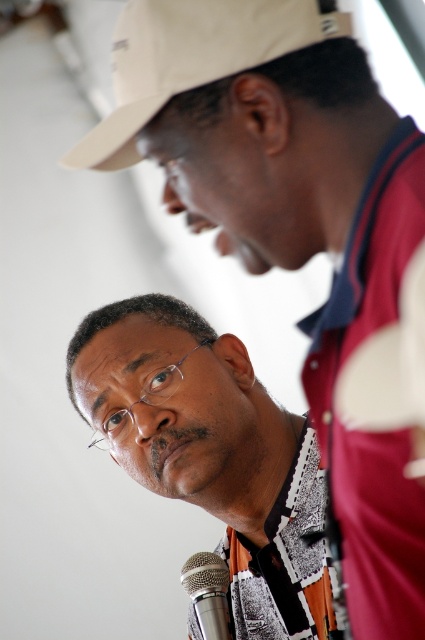
You are a photographer at an indoor event. You need to capture a photo of the white textured shirt at center and the silver metallic microphone at lower center. Which object should you focus on first if you want to ensure both are in focus?

The white textured shirt at center is above the silver metallic microphone at lower center, so you should focus on the white textured shirt at center first to ensure both are in focus.

You are a photographer adjusting your camera settings to capture a clear shot of the beige fabric cap at upper center. The camera has a minimum focus distance of 70 centimeters. Will the cap be in focus?

The beige fabric cap at upper center is 72.67 centimeters from the camera, which is beyond the minimum focus distance of 70 centimeters. Therefore, the cap should be in focus.